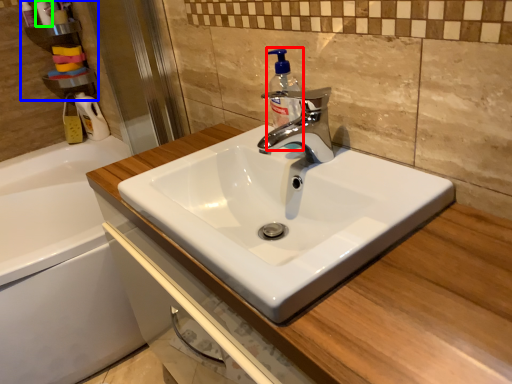
Question: Estimate the real-world distances between objects in this image. Which object is farther from soap dispenser (highlighted by a red box), shelf (highlighted by a blue box) or toiletry (highlighted by a green box)?

Choices:
 (A) shelf
 (B) toiletry

Answer: (B)